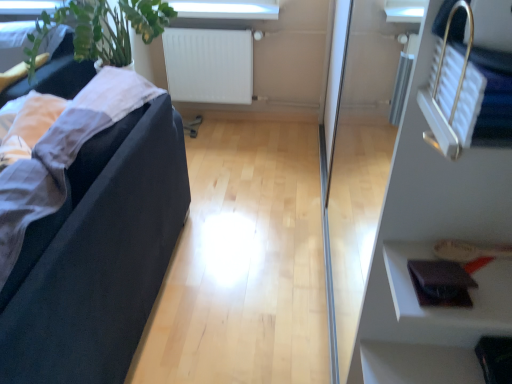
Question: Is leather wallet at lower right at the right side of white matte radiator at upper center?

Choices:
 (A) yes
 (B) no

Answer: (A)

Question: Does leather wallet at lower right have a lesser width compared to white matte radiator at upper center?

Choices:
 (A) no
 (B) yes

Answer: (B)

Question: From a real-world perspective, is leather wallet at lower right on white matte radiator at upper center?

Choices:
 (A) no
 (B) yes

Answer: (B)

Question: From a real-world perspective, is leather wallet at lower right positioned under white matte radiator at upper center based on gravity?

Choices:
 (A) yes
 (B) no

Answer: (B)

Question: Is leather wallet at lower right placed right next to white matte radiator at upper center?

Choices:
 (A) yes
 (B) no

Answer: (B)

Question: From the image's perspective, does leather wallet at lower right appear lower than white matte radiator at upper center?

Choices:
 (A) no
 (B) yes

Answer: (B)

Question: Is leather wallet at lower right positioned in front of black fabric couch at left?

Choices:
 (A) yes
 (B) no

Answer: (B)

Question: From the image's perspective, would you say leather wallet at lower right is shown under black fabric couch at left?

Choices:
 (A) yes
 (B) no

Answer: (A)

Question: Is leather wallet at lower right taller than black fabric couch at left?

Choices:
 (A) yes
 (B) no

Answer: (B)

Question: Can you confirm if leather wallet at lower right is thinner than black fabric couch at left?

Choices:
 (A) no
 (B) yes

Answer: (B)

Question: Is leather wallet at lower right far away from black fabric couch at left?

Choices:
 (A) no
 (B) yes

Answer: (A)

Question: Could you tell me if leather wallet at lower right is facing black fabric couch at left?

Choices:
 (A) yes
 (B) no

Answer: (B)

Question: Does transparent glass door at right come behind white matte radiator at upper center?

Choices:
 (A) yes
 (B) no

Answer: (B)